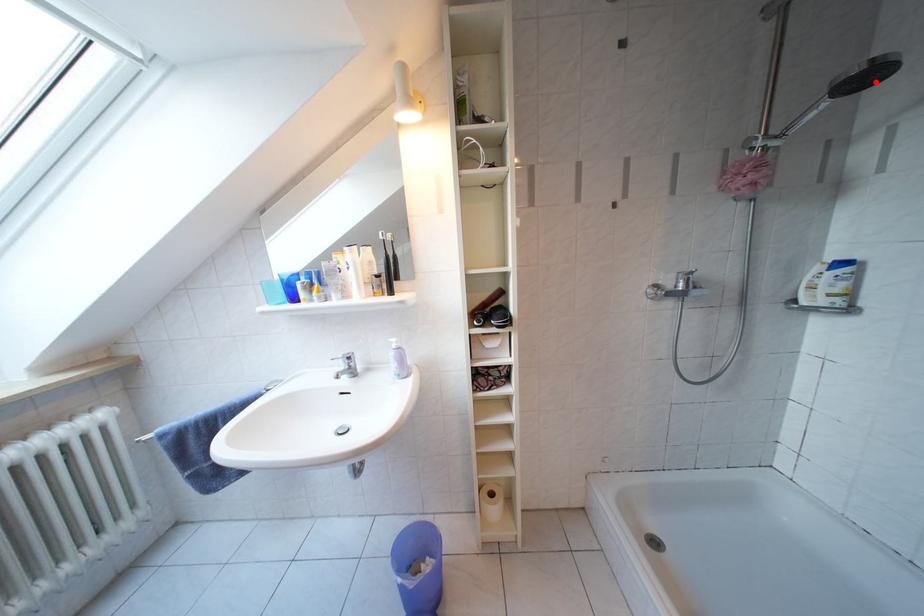
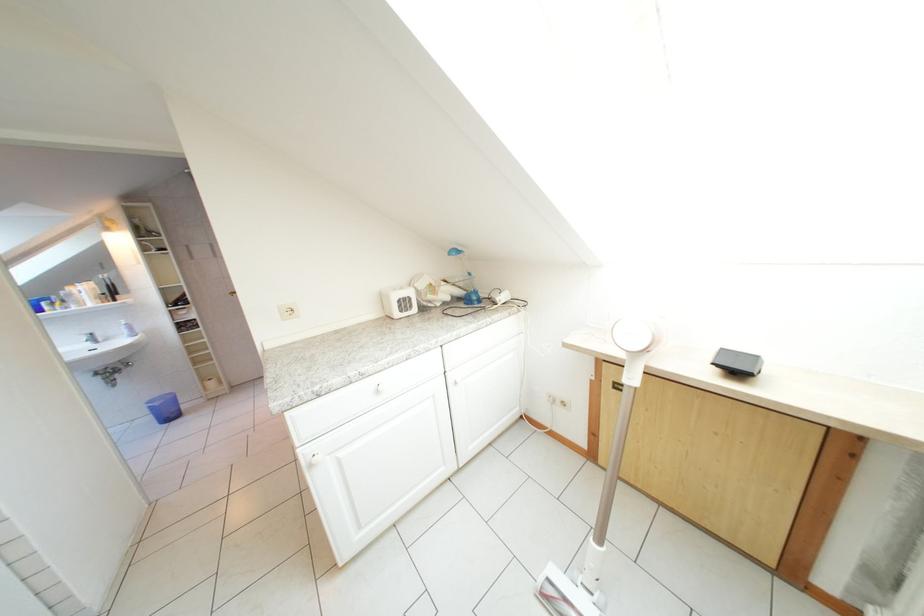
Question: I am providing you with two images of the same scene from different viewpoints. A red point is marked on the first image. Is the red point's position out of view in image 2?

Choices:
 (A) Yes
 (B) No

Answer: (A)